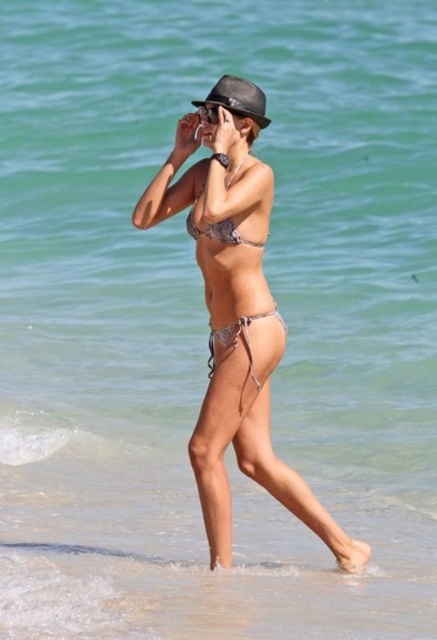
Is metallic bikini at center thinner than shiny silver bikini top at center?

No.

Between point (267, 307) and point (197, 195), which one is positioned in front?

Point (267, 307)

Identify the location of metallic bikini at center. The width and height of the screenshot is (437, 640). (235, 323).

Does shiny metallic bikini at center have a smaller size compared to matte black fedora at upper center?

Actually, shiny metallic bikini at center might be larger than matte black fedora at upper center.

Can you confirm if shiny metallic bikini at center is thinner than matte black fedora at upper center?

In fact, shiny metallic bikini at center might be wider than matte black fedora at upper center.

At what (x,y) coordinates should I click in order to perform the action: click on shiny metallic bikini at center. Please return your answer as a coordinate pair (x, y). This screenshot has width=437, height=640. Looking at the image, I should click on (236, 339).

Is shiny metallic bikini at center bigger than shiny silver bikini top at center?

Actually, shiny metallic bikini at center might be smaller than shiny silver bikini top at center.

Between point (225, 330) and point (232, 234), which one is positioned behind?

Point (225, 330)

Find the location of a particular element. This screenshot has width=437, height=640. shiny metallic bikini at center is located at coordinates (236, 339).